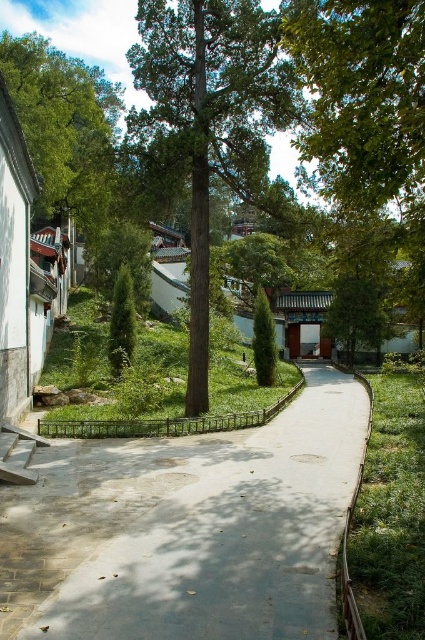
Question: Is gray concrete pavement at center to the left of green textured tree at center from the viewer's perspective?

Choices:
 (A) yes
 (B) no

Answer: (B)

Question: Which of the following is the closest to the observer?

Choices:
 (A) green textured tree at center
 (B) gray concrete pavement at center

Answer: (B)

Question: Which object appears closest to the camera in this image?

Choices:
 (A) green textured tree at center
 (B) gray concrete pavement at center

Answer: (B)

Question: Does gray concrete pavement at center appear on the left side of green textured tree at center?

Choices:
 (A) no
 (B) yes

Answer: (A)

Question: Can you confirm if gray concrete pavement at center is wider than green textured tree at center?

Choices:
 (A) yes
 (B) no

Answer: (A)

Question: Which of the following is the closest to the observer?

Choices:
 (A) gray concrete pavement at center
 (B) green textured tree at center

Answer: (A)